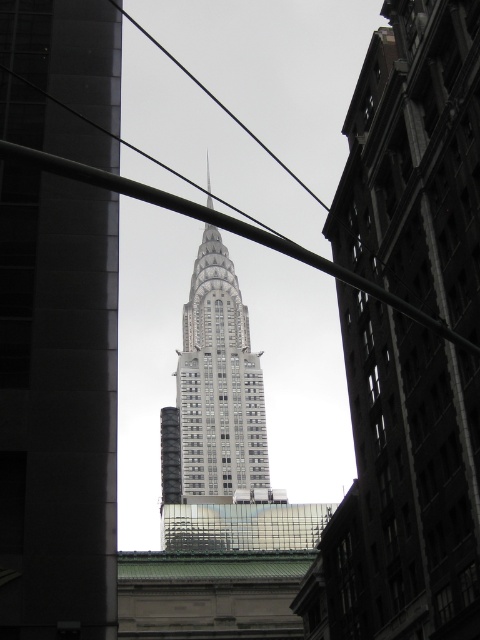
Looking at this image, you are standing at the point marked by the coordinates point (x=57, y=406), which is the location of the gray glass skyscraper at center. You want to take a photo of the Chrysler Building without any obstructions. Which direction should you move to avoid the foreground bars?

The gray glass skyscraper at center is represented by point (x=57, y=406). To avoid the foreground bars, you should move in the direction away from the foreground bars, which are crossing diagonally across the frame in the foreground. Since the point is at the center, moving towards the spire of the Chrysler Building would likely provide a clearer view without obstruction.

You are standing at the camera position and want to take a photo of the silver glass skyscraper at center. The camera has a focal length of 50mm. According to the rule of thirds, should you move closer or farther away to frame the skyscraper properly?

The silver glass skyscraper at center is 126.80 meters away from the camera. To follow the rule of thirds, you would need to adjust your distance so that the skyscraper aligns with the grid lines. However, without specific measurements for the rule of thirds composition, it is not possible to determine if moving closer or farther is needed based solely on the distance provided.